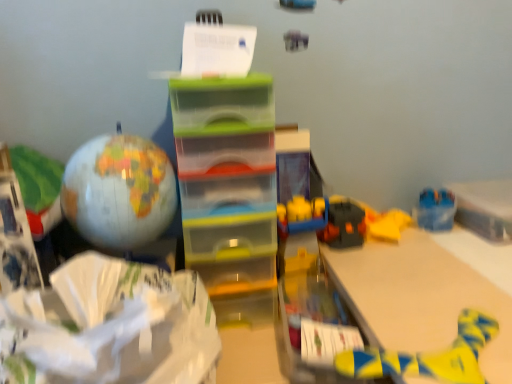
Question: Is matte globe at left completely or partially outside of white matte wrapping paper at lower left?

Choices:
 (A) yes
 (B) no

Answer: (A)

Question: Can you confirm if matte globe at left is positioned to the left of white matte wrapping paper at lower left?

Choices:
 (A) no
 (B) yes

Answer: (B)

Question: Does matte globe at left touch white matte wrapping paper at lower left?

Choices:
 (A) no
 (B) yes

Answer: (A)

Question: Is matte globe at left oriented away from white matte wrapping paper at lower left?

Choices:
 (A) yes
 (B) no

Answer: (B)

Question: From the image's perspective, does matte globe at left appear higher than white matte wrapping paper at lower left?

Choices:
 (A) yes
 (B) no

Answer: (A)

Question: Would you say white matte wrapping paper at lower left is part of matte globe at left's contents?

Choices:
 (A) yes
 (B) no

Answer: (B)

Question: Can you confirm if white matte wrapping paper at lower left is taller than white paper at upper center?

Choices:
 (A) yes
 (B) no

Answer: (A)

Question: Considering the relative sizes of white matte wrapping paper at lower left and white paper at upper center in the image provided, is white matte wrapping paper at lower left shorter than white paper at upper center?

Choices:
 (A) yes
 (B) no

Answer: (B)

Question: Are white matte wrapping paper at lower left and white paper at upper center located far from each other?

Choices:
 (A) yes
 (B) no

Answer: (B)

Question: Considering the relative positions of white matte wrapping paper at lower left and white paper at upper center in the image provided, is white matte wrapping paper at lower left to the right of white paper at upper center from the viewer's perspective?

Choices:
 (A) no
 (B) yes

Answer: (A)

Question: Does white matte wrapping paper at lower left have a larger size compared to white paper at upper center?

Choices:
 (A) no
 (B) yes

Answer: (B)

Question: Is white matte wrapping paper at lower left closer to camera compared to white paper at upper center?

Choices:
 (A) yes
 (B) no

Answer: (A)

Question: Is yellow fabric toy at lower right thinner than white matte wrapping paper at lower left?

Choices:
 (A) no
 (B) yes

Answer: (B)